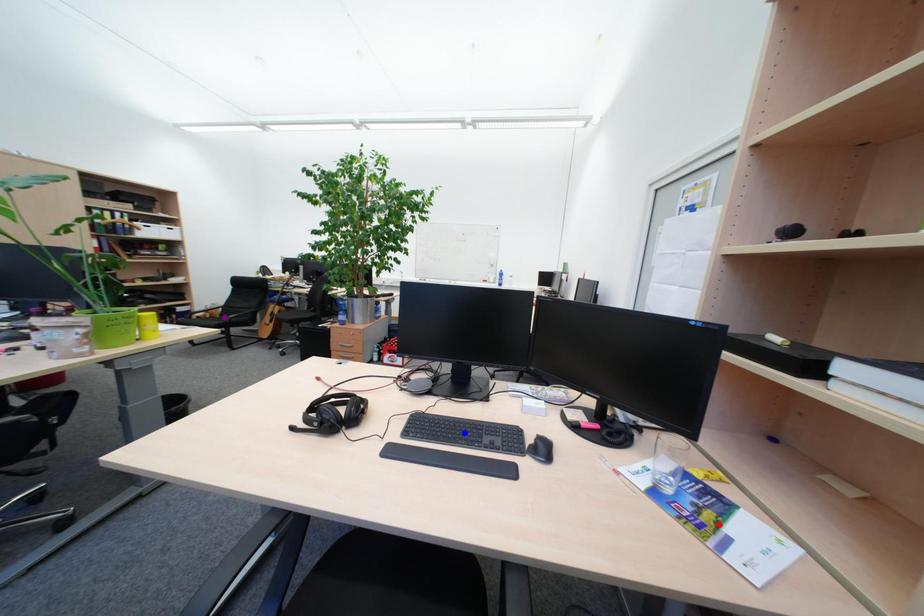
Order these from nearest to farthest:
- red point
- purple point
- blue point

red point → blue point → purple point